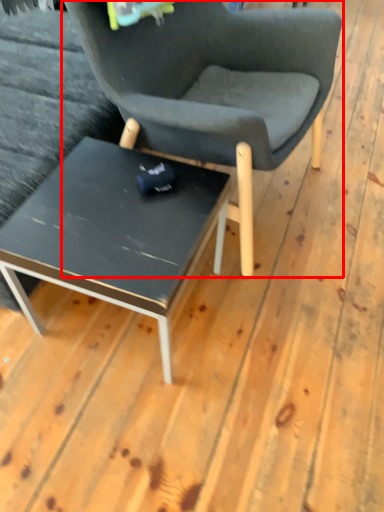
Question: In this image, where is chair (annotated by the red box) located relative to coffee table?

Choices:
 (A) left
 (B) right

Answer: (B)